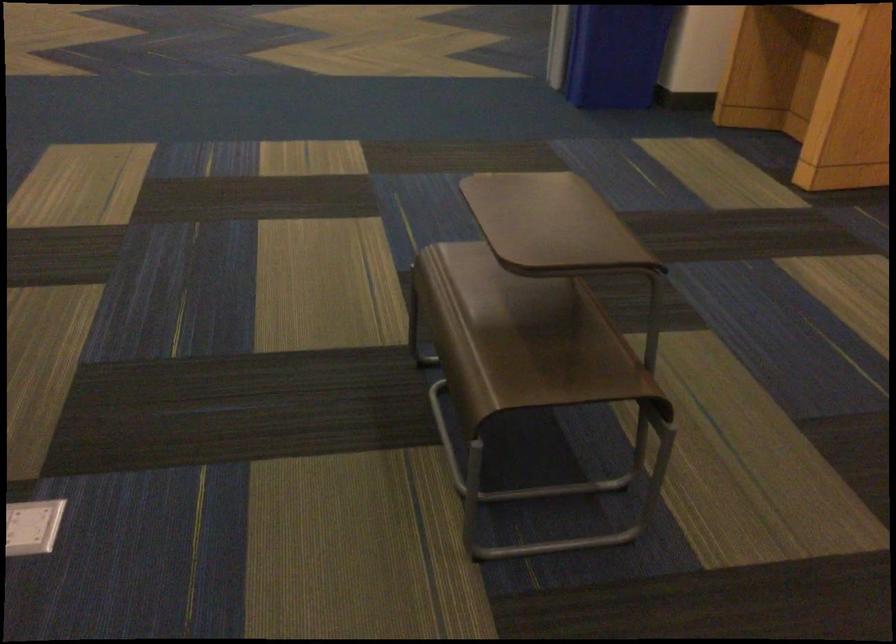
You are a GUI agent. You are given a task and a screenshot of the screen. Output one action in this format:
    pyautogui.click(x=<x>, y=<y>)
    Task: Click on the chair sitting surface
    The image size is (896, 644).
    Given the screenshot: What is the action you would take?
    pyautogui.click(x=531, y=346)